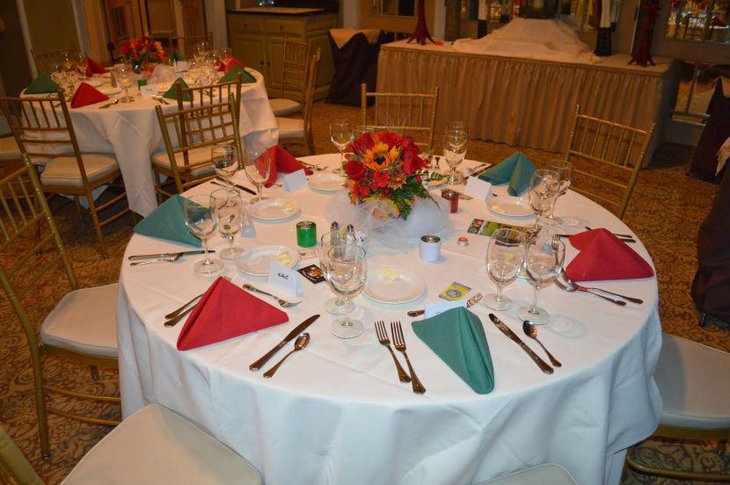
You are a GUI agent. You are given a task and a screenshot of the screen. Output one action in this format:
    pyautogui.click(x=<x>, y=<y>)
    Task: Click on the blue napkin
    The height and width of the screenshot is (485, 730).
    Given the screenshot: What is the action you would take?
    pyautogui.click(x=455, y=340)